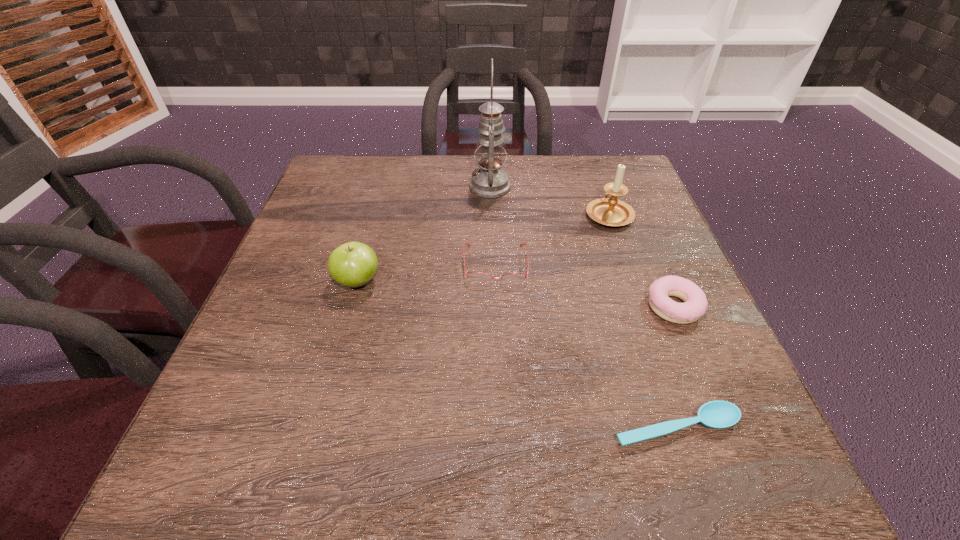
Find the location of a particular element. The image size is (960, 540). oil lamp is located at coordinates (490, 181).

Locate an element on the screen. the second tallest object is located at coordinates [x=608, y=211].

I want to click on apple, so (x=353, y=264).

Locate an element on the screen. the leftmost object is located at coordinates (353, 264).

This screenshot has width=960, height=540. Identify the location of the fourth tallest object. (695, 304).

In order to click on the second shortest object in this screenshot , I will do `click(477, 277)`.

Identify the location of spoon. The image size is (960, 540). (718, 414).

Where is `the shortest object`? The height and width of the screenshot is (540, 960). the shortest object is located at coordinates (718, 414).

The height and width of the screenshot is (540, 960). In order to click on vacant space situated 0.080m on the right of the oil lamp in this screenshot , I will do `click(541, 187)`.

Identify the location of vacant space situated with a handle on the side of the fifth shortest object. (594, 173).